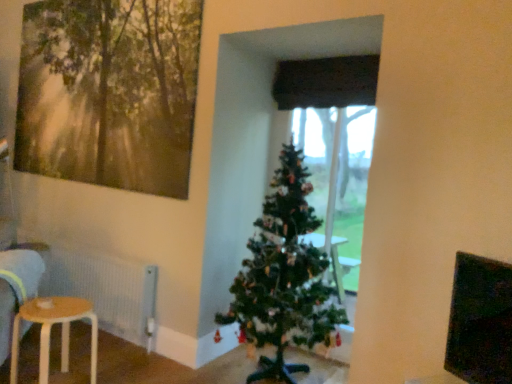
Question: Does point (227, 314) appear closer or farther from the camera than point (45, 327)?

Choices:
 (A) closer
 (B) farther

Answer: (B)

Question: Would you say green matte christmas tree at center is to the left or to the right of light brown wooden stool at lower left in the picture?

Choices:
 (A) right
 (B) left

Answer: (A)

Question: Considering the real-world distances, which object is closest to the white textured radiator at lower left?

Choices:
 (A) black matte window screen at upper right
 (B) green matte christmas tree at center
 (C) light brown wooden stool at lower left
 (D) wooden painting at upper left
 (E) black fabric curtain at center

Answer: (C)

Question: Considering the real-world distances, which object is farthest from the black matte window screen at upper right?

Choices:
 (A) wooden painting at upper left
 (B) white textured radiator at lower left
 (C) black fabric curtain at center
 (D) green matte christmas tree at center
 (E) light brown wooden stool at lower left

Answer: (A)